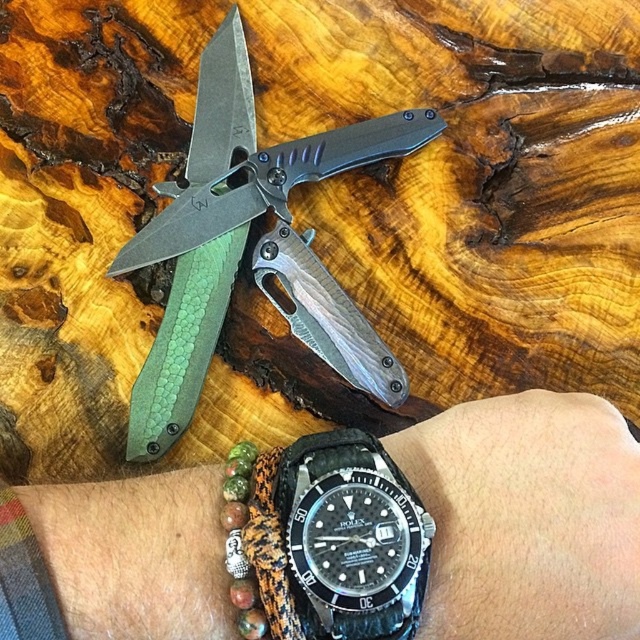
Question: Does black leather watch at lower right have a smaller size compared to black rubber watch at lower center?

Choices:
 (A) yes
 (B) no

Answer: (B)

Question: Among these objects, which one is farthest from the camera?

Choices:
 (A) green textured knife at upper center
 (B) black leather watch at lower right

Answer: (A)

Question: Which point is closer to the camera?

Choices:
 (A) green textured knife at upper center
 (B) black rubber watch at lower center
 (C) black leather watch at lower right

Answer: (B)

Question: Can you confirm if black leather watch at lower right is bigger than green textured knife at upper center?

Choices:
 (A) yes
 (B) no

Answer: (B)

Question: Which point is farther to the camera?

Choices:
 (A) black rubber watch at lower center
 (B) green textured knife at upper center

Answer: (B)

Question: Where is black leather watch at lower right located in relation to green textured knife at upper center in the image?

Choices:
 (A) above
 (B) below

Answer: (B)